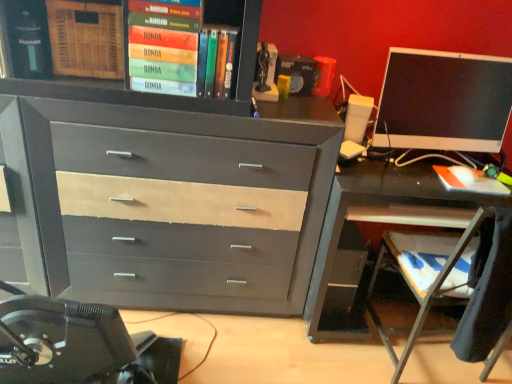
I want to click on matte gray wood chest of drawers at center, so click(167, 198).

Image resolution: width=512 pixels, height=384 pixels. What do you see at coordinates (167, 198) in the screenshot?
I see `matte gray wood chest of drawers at center` at bounding box center [167, 198].

This screenshot has width=512, height=384. I want to click on matte black monitor at right, so click(x=443, y=101).

This screenshot has height=384, width=512. In order to click on green matte book at upper center, which is the 3th book in bottom-to-top order in this screenshot , I will do `click(162, 45)`.

Identify the location of hardcover book at upper center, arranged as the 2th book when viewed from the left. The height and width of the screenshot is (384, 512). (216, 61).

Would you say wooden at lower right contains matte black monitor at right?

No, wooden at lower right does not contain matte black monitor at right.

Considering the relative sizes of wooden at lower right and matte black monitor at right in the image provided, is wooden at lower right smaller than matte black monitor at right?

No, wooden at lower right is not smaller than matte black monitor at right.

Can you tell me how much wooden at lower right and matte black monitor at right differ in facing direction?

There is a 178-degree angle between the facing directions of wooden at lower right and matte black monitor at right.

Could you tell me if hardcover book at upper center, placed as the second book when sorted from bottom to top, is facing metallic gray desk at right?

No.

Considering the relative positions of hardcover book at upper center, which ranks as the 2th book in right-to-left order, and metallic gray desk at right in the image provided, is hardcover book at upper center, which ranks as the 2th book in right-to-left order, in front of metallic gray desk at right?

Yes.

Who is bigger, hardcover book at upper center, acting as the second book starting from the top, or metallic gray desk at right?

Bigger between the two is metallic gray desk at right.

Who is shorter, metallic gray desk at right or green matte book at upper center, placed as the first book when sorted from top to bottom?

With less height is green matte book at upper center, placed as the first book when sorted from top to bottom.

From the image's perspective, which is above, metallic gray desk at right or green matte book at upper center, placed as the first book when sorted from top to bottom?

green matte book at upper center, placed as the first book when sorted from top to bottom.

Is metallic gray desk at right oriented towards green matte book at upper center, placed as the first book when sorted from top to bottom?

No.

From a real-world perspective, is metallic gray desk at right positioned under green matte book at upper center, the 1th book positioned from the left, based on gravity?

Indeed, from a real-world perspective, metallic gray desk at right is positioned beneath green matte book at upper center, the 1th book positioned from the left.

Is wooden at lower right bigger or smaller than orange matte book at right, the 3th book when ordered from left to right?

wooden at lower right is bigger than orange matte book at right, the 3th book when ordered from left to right.

Can you confirm if wooden at lower right is thinner than orange matte book at right, the 3th book when ordered from left to right?

No.

From the image's perspective, starting from the wooden at lower right, which book is the 1st one above? Please provide its 2D coordinates.

[(469, 180)]

From a real-world perspective, does wooden at lower right sit lower than orange matte book at right, the 3th book when ordered from left to right?

Yes.

Looking at this image, is green matte book at upper center, the 1th book positioned from the left, shorter than matte black monitor at right?

Indeed, green matte book at upper center, the 1th book positioned from the left, has a lesser height compared to matte black monitor at right.

Looking at this image, is green matte book at upper center, which is the 3th book in bottom-to-top order, situated inside matte black monitor at right or outside?

green matte book at upper center, which is the 3th book in bottom-to-top order, lies outside matte black monitor at right.

Is matte black monitor at right oriented towards green matte book at upper center, which is the 3th book from right to left?

No, matte black monitor at right is not facing towards green matte book at upper center, which is the 3th book from right to left.

Is matte black monitor at right behind green matte book at upper center, placed as the first book when sorted from top to bottom?

Yes.

Considering the relative sizes of matte black monitor at right and green matte book at upper center, placed as the first book when sorted from top to bottom, in the image provided, is matte black monitor at right taller than green matte book at upper center, placed as the first book when sorted from top to bottom,?

Yes.

This screenshot has height=384, width=512. I want to click on the 2nd book in front of the matte black monitor at right, so click(x=162, y=45).

Which object is positioned more to the left, wooden at lower right or green matte book at upper center, placed as the first book when sorted from top to bottom?

green matte book at upper center, placed as the first book when sorted from top to bottom.

Find the location of a particular element. Image resolution: width=512 pixels, height=384 pixels. computer chair that appears below the green matte book at upper center, which is the 3th book from right to left (from a real-world perspective) is located at coordinates (428, 275).

Is wooden at lower right positioned behind green matte book at upper center, which is the 3th book from right to left?

No, wooden at lower right is closer to the camera.

Is wooden at lower right aimed at green matte book at upper center, which is the 3th book in bottom-to-top order?

No, wooden at lower right is not oriented towards green matte book at upper center, which is the 3th book in bottom-to-top order.

Where is `computer monitor above the wooden at lower right (from the image's perspective)`? The image size is (512, 384). computer monitor above the wooden at lower right (from the image's perspective) is located at coordinates (443, 101).

Find the location of a particular element. Image resolution: width=512 pixels, height=384 pixels. the 1st book in front of the metallic gray desk at right is located at coordinates (216, 61).

Estimate the real-world distances between objects in this image. Which object is closer to wooden at lower right, hardcover book at upper center, placed as the second book when sorted from bottom to top, or orange matte book at right, the first book viewed from the right?

The object closer to wooden at lower right is orange matte book at right, the first book viewed from the right.

When comparing their distances from metallic gray desk at right, does matte black monitor at right or wooden at lower right seem closer?

The object closer to metallic gray desk at right is wooden at lower right.

Consider the image. Based on their spatial positions, is metallic gray desk at right or orange matte book at right, the first book viewed from the right, further from matte black monitor at right?

Among the two, metallic gray desk at right is located further to matte black monitor at right.

From the image, which object appears to be nearer to hardcover book at upper center, acting as the second book starting from the top, matte black monitor at right or green matte book at upper center, which is the 3th book in bottom-to-top order?

green matte book at upper center, which is the 3th book in bottom-to-top order.

Based on their spatial positions, is hardcover book at upper center, acting as the second book starting from the top, or green matte book at upper center, the 1th book positioned from the left, further from orange matte book at right, the 3th book when ordered from left to right?

The object further to orange matte book at right, the 3th book when ordered from left to right, is green matte book at upper center, the 1th book positioned from the left.

Which object lies further to the anchor point matte black monitor at right, hardcover book at upper center, acting as the second book starting from the top, or green matte book at upper center, which is the 3th book in bottom-to-top order?

Among the two, green matte book at upper center, which is the 3th book in bottom-to-top order, is located further to matte black monitor at right.

Looking at the image, which one is located further to matte gray wood chest of drawers at center, wooden at lower right or green matte book at upper center, which is the 3th book from right to left?

The object further to matte gray wood chest of drawers at center is wooden at lower right.

From the image, which object appears to be farther from hardcover book at upper center, acting as the second book starting from the top, orange matte book at right, the first book viewed from the right, or matte gray wood chest of drawers at center?

orange matte book at right, the first book viewed from the right.

Where is `computer chair between hardcover book at upper center, placed as the second book when sorted from bottom to top, and orange matte book at right, placed as the first book when sorted from bottom to top`? The height and width of the screenshot is (384, 512). computer chair between hardcover book at upper center, placed as the second book when sorted from bottom to top, and orange matte book at right, placed as the first book when sorted from bottom to top is located at coordinates (428, 275).

Where is `desk situated between matte gray wood chest of drawers at center and matte black monitor at right from left to right`? desk situated between matte gray wood chest of drawers at center and matte black monitor at right from left to right is located at coordinates (378, 222).

Image resolution: width=512 pixels, height=384 pixels. I want to click on book between green matte book at upper center, the 1th book positioned from the left, and matte black monitor at right from left to right, so click(x=216, y=61).

You are a GUI agent. You are given a task and a screenshot of the screen. Output one action in this format:
    pyautogui.click(x=<x>, y=<y>)
    Task: Click on the desk situated between green matte book at upper center, which is the 3th book in bottom-to-top order, and orange matte book at right, placed as the first book when sorted from bottom to top, from left to right
    
    Given the screenshot: What is the action you would take?
    pyautogui.click(x=378, y=222)